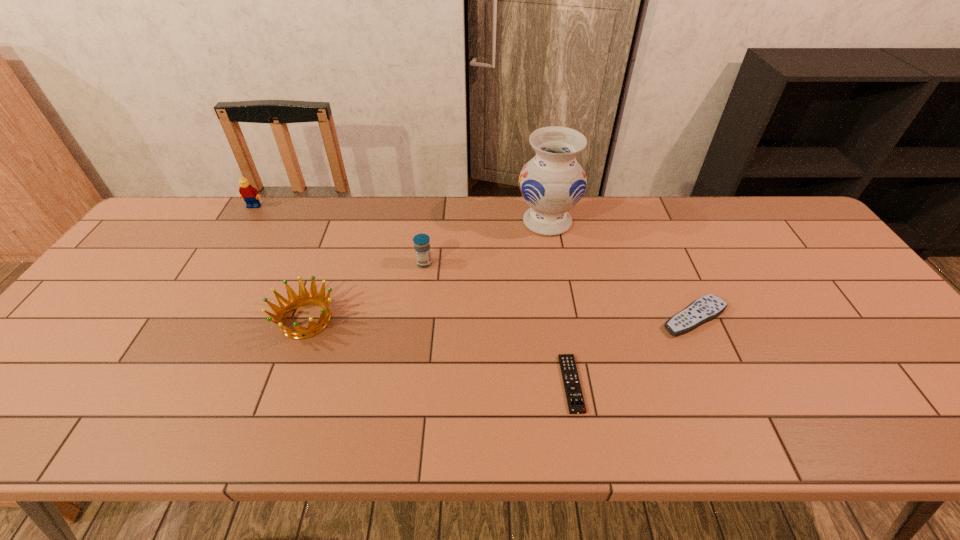
You are a GUI agent. You are given a task and a screenshot of the screen. Output one action in this format:
    pyautogui.click(x=<x>, y=<y>)
    Task: Click on the tallest object
    Image resolution: width=960 pixels, height=540 pixels.
    Given the screenshot: What is the action you would take?
    pyautogui.click(x=552, y=182)

Identify the location of the leftmost object. (250, 194).

The width and height of the screenshot is (960, 540). Find the location of `the fourth nearest object`. the fourth nearest object is located at coordinates (421, 241).

Find the location of a particular element. The image size is (960, 540). the fourth object from right to left is located at coordinates (421, 241).

Identify the location of the second object from left to right. (294, 301).

You are a GUI agent. You are given a task and a screenshot of the screen. Output one action in this format:
    pyautogui.click(x=<x>, y=<y>)
    Task: Click on the fifth tallest object
    
    Given the screenshot: What is the action you would take?
    pyautogui.click(x=708, y=307)

Identify the location of the right remote control. Image resolution: width=960 pixels, height=540 pixels. (708, 307).

Identify the location of the left remote control. (575, 400).

This screenshot has width=960, height=540. I want to click on the nearer remote control, so click(x=575, y=400).

Where is `vacant space located 0.070m on the left of the vase`? The width and height of the screenshot is (960, 540). vacant space located 0.070m on the left of the vase is located at coordinates (494, 222).